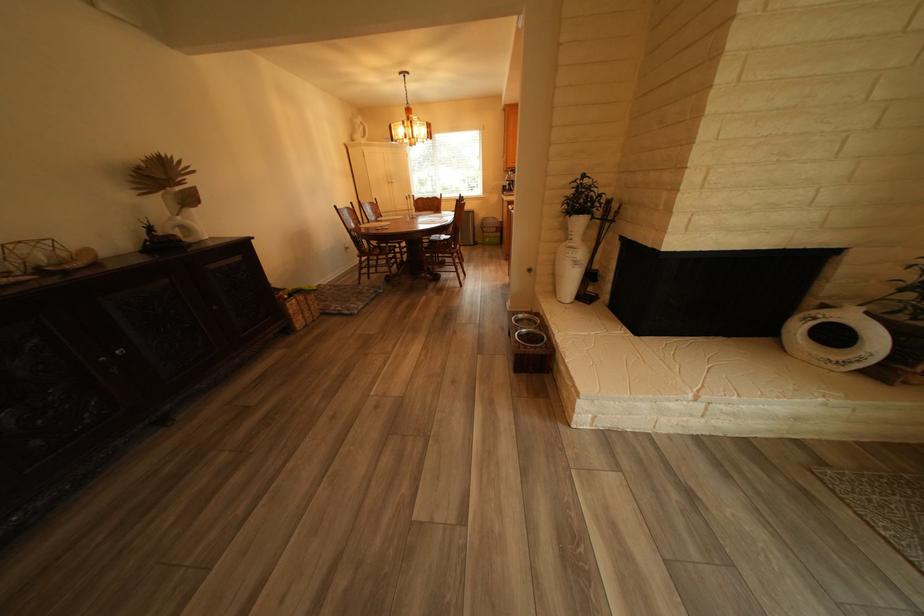
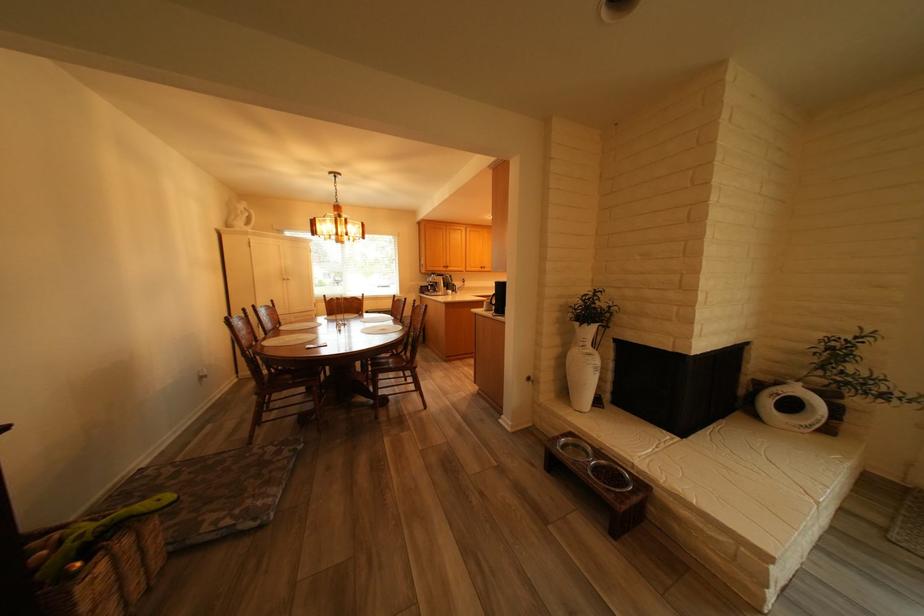
Find the pixel in the second image that matches (371,128) in the first image.

(253, 213)